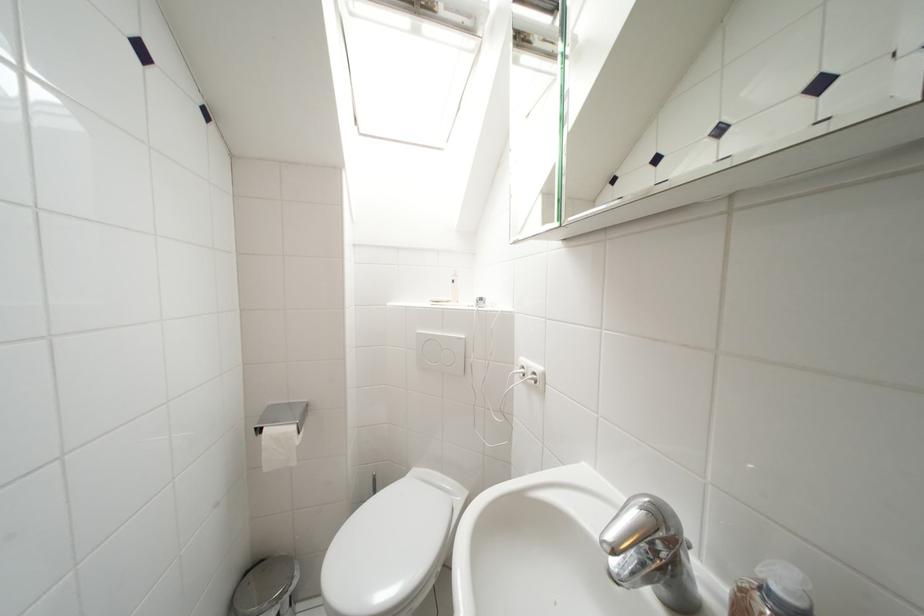
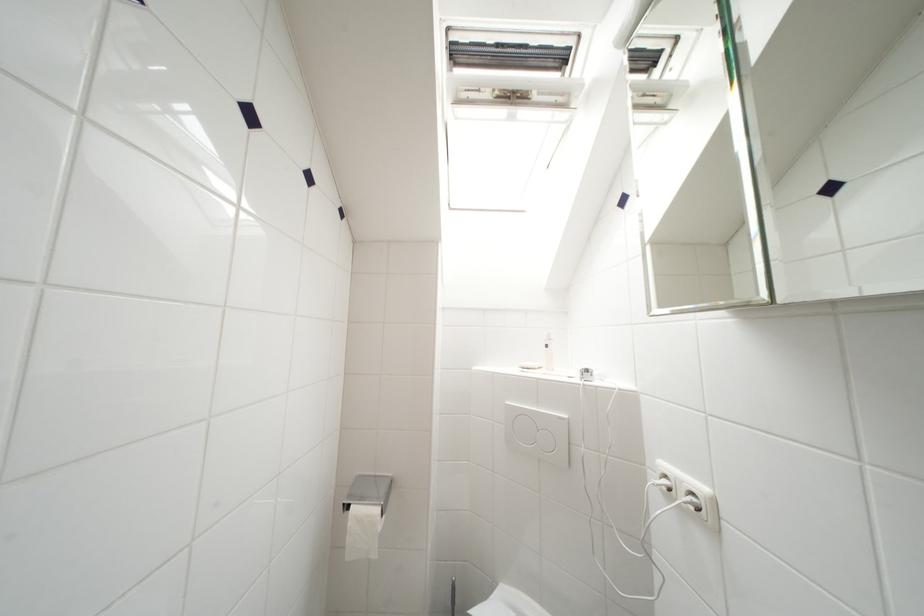
Question: The camera is either moving clockwise (left) or counter-clockwise (right) around the object. The first image is from the beginning of the video and the second image is from the end. Is the camera moving left or right when shooting the video?

Choices:
 (A) Left
 (B) Right

Answer: (B)